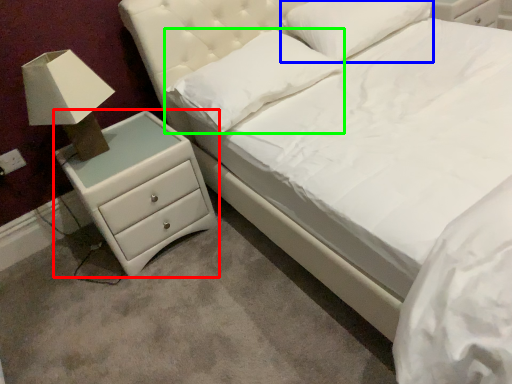
Question: Which object is the farthest from chest of drawers (highlighted by a red box)? Choose among these: pillow (highlighted by a blue box) or pillow (highlighted by a green box).

Choices:
 (A) pillow
 (B) pillow

Answer: (A)